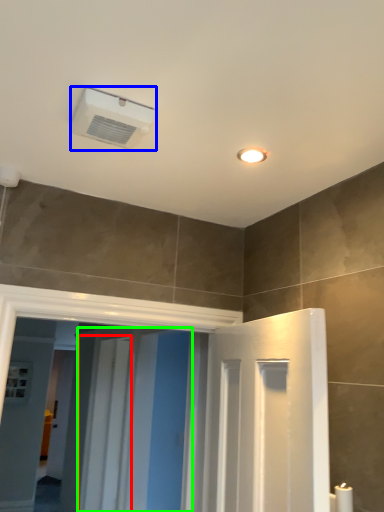
Question: Considering the real-world distances, which object is farthest from screen door (highlighted by a red box)? air conditioning (highlighted by a blue box) or screen door (highlighted by a green box)?

Choices:
 (A) air conditioning
 (B) screen door

Answer: (A)